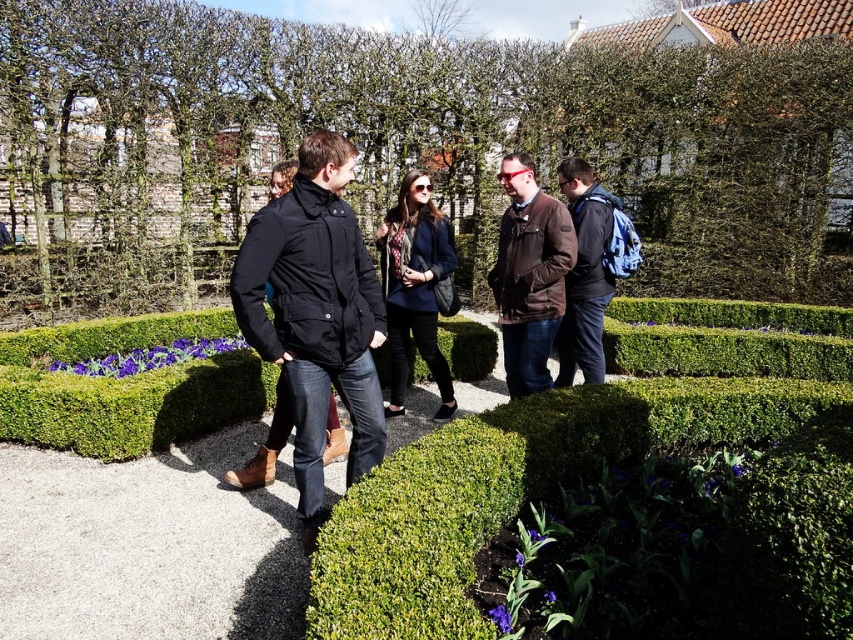
Who is positioned more to the right, smooth concrete path at center or black matte jacket at center?

From the viewer's perspective, black matte jacket at center appears more on the right side.

In the scene shown: Does smooth concrete path at center have a lesser height compared to black matte jacket at center?

Indeed, smooth concrete path at center has a lesser height compared to black matte jacket at center.

Is point (7, 595) positioned in front of point (276, 301)?

Yes.

Locate an element on the screen. smooth concrete path at center is located at coordinates (148, 545).

Which of these two, brown leather jacket at center or blue backpack at center, stands shorter?

Standing shorter between the two is brown leather jacket at center.

Which is in front, point (500, 317) or point (585, 369)?

Point (500, 317) is more forward.

Which is behind, point (556, 298) or point (611, 225)?

Point (611, 225)

This screenshot has width=853, height=640. In order to click on brown leather jacket at center in this screenshot , I will do `click(529, 275)`.

Does black matte jacket at center have a lesser height compared to blue backpack at center?

Incorrect, black matte jacket at center's height does not fall short of blue backpack at center's.

Does black matte jacket at center have a smaller size compared to blue backpack at center?

Indeed, black matte jacket at center has a smaller size compared to blue backpack at center.

Where is `black matte jacket at center`? The width and height of the screenshot is (853, 640). black matte jacket at center is located at coordinates click(x=315, y=314).